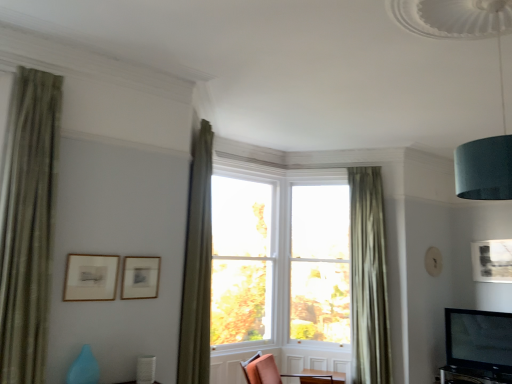
Question: Considering the relative sizes of green textured curtain at left, marked as the 1th curtain in a front-to-back arrangement, and matte orange chair at center in the image provided, is green textured curtain at left, marked as the 1th curtain in a front-to-back arrangement, shorter than matte orange chair at center?

Choices:
 (A) no
 (B) yes

Answer: (A)

Question: Is green textured curtain at left, marked as the third curtain in a right-to-left arrangement, in contact with matte orange chair at center?

Choices:
 (A) yes
 (B) no

Answer: (B)

Question: Can you confirm if green textured curtain at left, marked as the third curtain in a right-to-left arrangement, is thinner than matte orange chair at center?

Choices:
 (A) yes
 (B) no

Answer: (A)

Question: Does green textured curtain at left, which is the 1th curtain from left to right, turn towards matte orange chair at center?

Choices:
 (A) yes
 (B) no

Answer: (B)

Question: From the image's perspective, is green textured curtain at left, which is the 3th curtain from back to front, beneath matte orange chair at center?

Choices:
 (A) no
 (B) yes

Answer: (A)

Question: Considering the relative positions of matte orange chair at center and green textured curtain at upper center, which appears as the 2th curtain when viewed from the front, in the image provided, is matte orange chair at center to the left or to the right of green textured curtain at upper center, which appears as the 2th curtain when viewed from the front,?

Choices:
 (A) right
 (B) left

Answer: (A)

Question: Considering the positions of matte orange chair at center and green textured curtain at upper center, which appears as the 2th curtain when viewed from the front, in the image, is matte orange chair at center taller or shorter than green textured curtain at upper center, which appears as the 2th curtain when viewed from the front,?

Choices:
 (A) short
 (B) tall

Answer: (A)

Question: Which is correct: matte orange chair at center is inside green textured curtain at upper center, which is counted as the 2th curtain, starting from the right, or outside of it?

Choices:
 (A) inside
 (B) outside

Answer: (B)

Question: In the image, is matte orange chair at center positioned in front of or behind green textured curtain at upper center, acting as the 2th curtain starting from the back?

Choices:
 (A) front
 (B) behind

Answer: (B)

Question: In terms of height, does green textured curtain at left, marked as the 1th curtain in a front-to-back arrangement, look taller or shorter compared to teal fabric lampshade at upper right?

Choices:
 (A) short
 (B) tall

Answer: (B)

Question: In terms of width, does green textured curtain at left, marked as the third curtain in a right-to-left arrangement, look wider or thinner when compared to teal fabric lampshade at upper right?

Choices:
 (A) thin
 (B) wide

Answer: (A)

Question: From a real-world perspective, relative to teal fabric lampshade at upper right, is green textured curtain at left, marked as the 1th curtain in a front-to-back arrangement, vertically above or below?

Choices:
 (A) below
 (B) above

Answer: (A)

Question: Is point (32, 210) positioned closer to the camera than point (394, 8)?

Choices:
 (A) closer
 (B) farther

Answer: (B)

Question: Choose the correct answer: Is matte black picture frame at upper right, marked as the 1th picture frame in a back-to-front arrangement, inside clear glass window at center or outside it?

Choices:
 (A) outside
 (B) inside

Answer: (A)

Question: Looking at their shapes, would you say matte black picture frame at upper right, marked as the 1th picture frame in a back-to-front arrangement, is wider or thinner than clear glass window at center?

Choices:
 (A) wide
 (B) thin

Answer: (B)